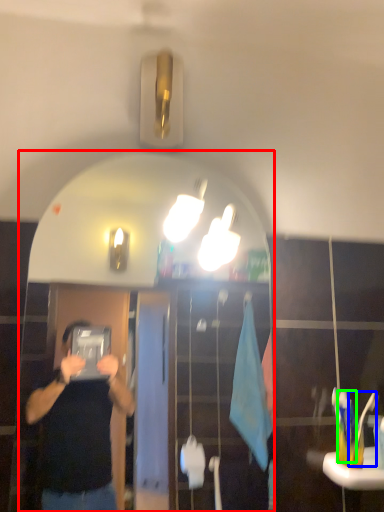
Question: Considering the real-world distances, which object is farthest from mirror (highlighted by a red box)? toothbrush (highlighted by a blue box) or toothbrush (highlighted by a green box)?

Choices:
 (A) toothbrush
 (B) toothbrush

Answer: (A)